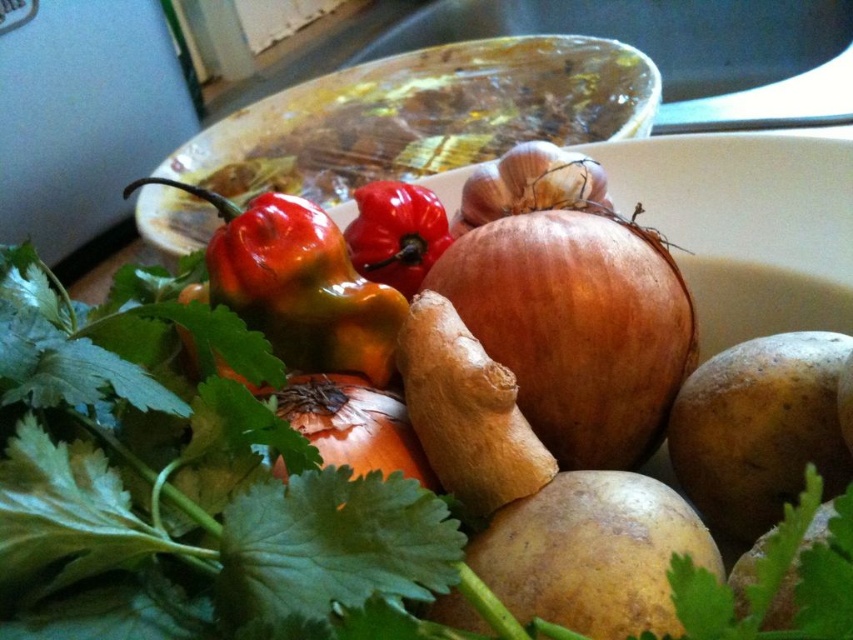
Question: Can you confirm if brown matte onion at center is bigger than brown matte potato at lower right?

Choices:
 (A) no
 (B) yes

Answer: (B)

Question: In this image, where is brown matte onion at center located relative to glossy orange pepper at center-left?

Choices:
 (A) above
 (B) below

Answer: (B)

Question: Is brown matte potato at center closer to camera compared to matte brown garlic at center?

Choices:
 (A) yes
 (B) no

Answer: (A)

Question: Which of the following is the closest to the observer?

Choices:
 (A) brown matte onion at center
 (B) matte brown garlic at center

Answer: (A)

Question: Among these objects, which one is farthest from the camera?

Choices:
 (A) matte brown garlic at center
 (B) glossy orange pepper at center-left
 (C) brown matte onion at center
 (D) brown matte potato at lower right

Answer: (A)

Question: Which point is farther to the camera?

Choices:
 (A) (328, 336)
 (B) (572, 166)
 (C) (839, 436)

Answer: (B)